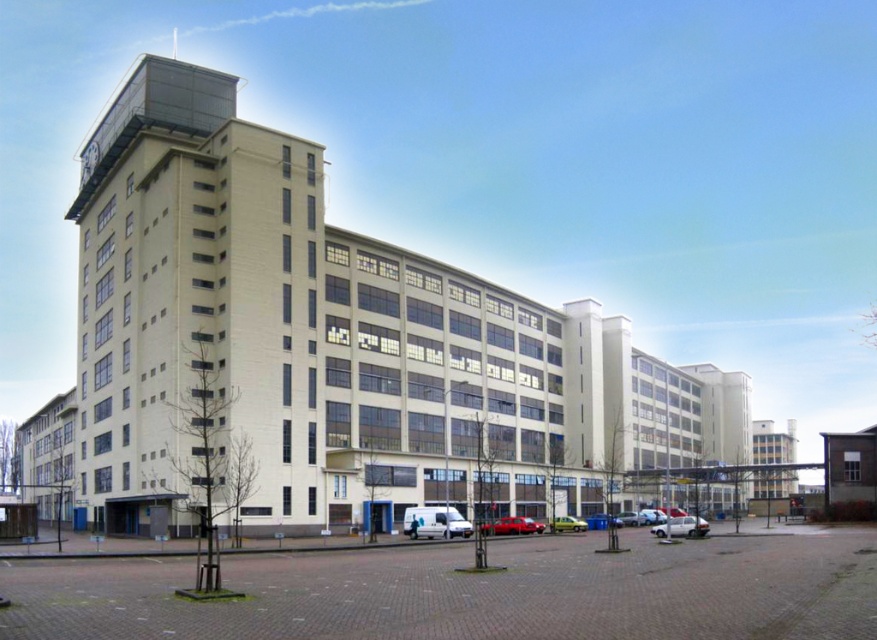
You are standing in front of the industrial building and want to reach the point marked as point (654, 525). Is this point within a safe distance for a drone to land?

The point (654, 525) is 95.79 meters away from the camera, so it is within a safe distance for a drone to land.

You are a parking attendant and need to park both the silver metallic car at lower center and the shiny red car at center in two available spots. The larger spot can accommodate bigger vehicles. Which car should you park in the larger spot?

The silver metallic car at lower center is bigger than the shiny red car at center, so it should be parked in the larger spot.

You are a delivery driver who needs to park your vehicle in the paved area in front of the building. You have a shiny red car at center and a yellow matte van at center. Which vehicle will require more space to park?

The shiny red car at center is bigger than the yellow matte van at center, so it will require more space to park.